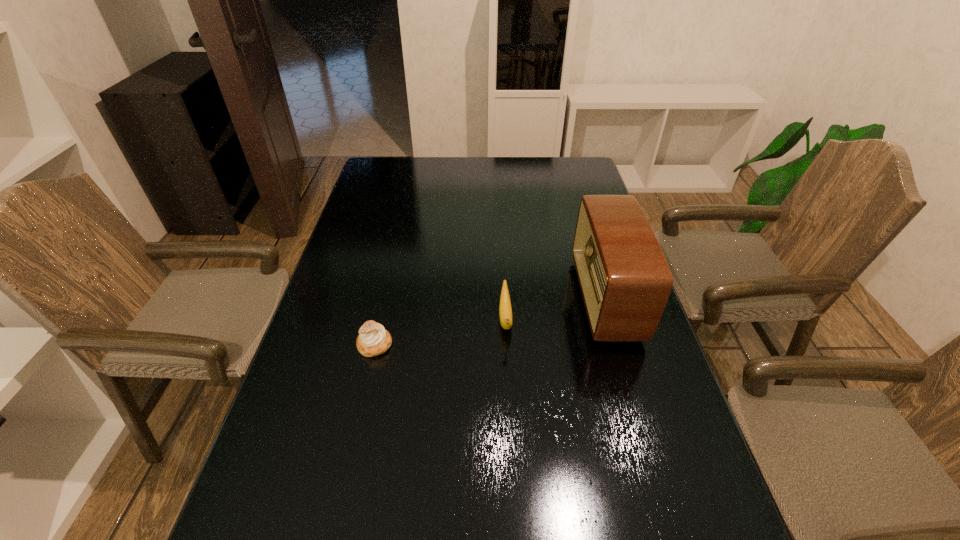
Where is `object present at the left edge`? The image size is (960, 540). object present at the left edge is located at coordinates (373, 339).

Image resolution: width=960 pixels, height=540 pixels. Identify the location of object positioned at the right edge. (625, 280).

This screenshot has width=960, height=540. Identify the location of blank space at the far edge of the desktop. (453, 178).

This screenshot has width=960, height=540. In the image, there is a desktop. What are the coordinates of `vacant space at the left edge` in the screenshot? It's located at (309, 328).

Locate an element on the screen. Image resolution: width=960 pixels, height=540 pixels. vacant space at the right edge of the desktop is located at coordinates (640, 500).

This screenshot has width=960, height=540. What are the coordinates of `vacant space at the far left corner of the desktop` in the screenshot? It's located at (376, 172).

Where is `free space at the far right corner`? The width and height of the screenshot is (960, 540). free space at the far right corner is located at coordinates pos(570,187).

The height and width of the screenshot is (540, 960). Identify the location of unoccupied position between the leftmost object and the second object from right to left. (441, 332).

Where is `unoccupied position between the shortest object and the rightmost object`? unoccupied position between the shortest object and the rightmost object is located at coordinates (490, 322).

Identify the location of free space between the rightmost object and the second object from right to left. (556, 309).